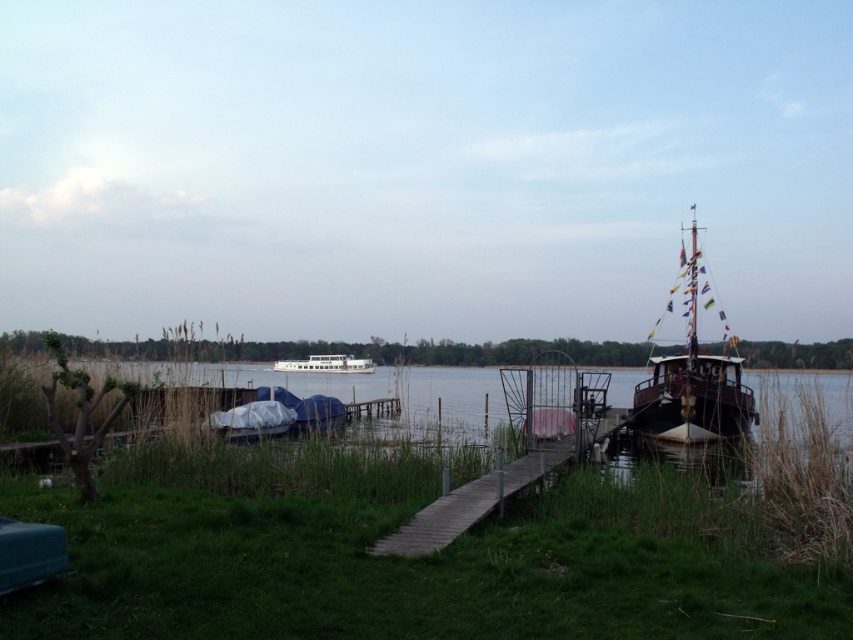
You are standing at the camera position and want to take a photo of the wooden sailboat at right. If your camera has a maximum zoom range of 10 meters, will you be able to capture the boat clearly without moving closer?

The wooden sailboat at right and the camera are 11.23 meters apart. Since the maximum zoom range is 10 meters, the camera cannot capture the boat clearly without moving closer.